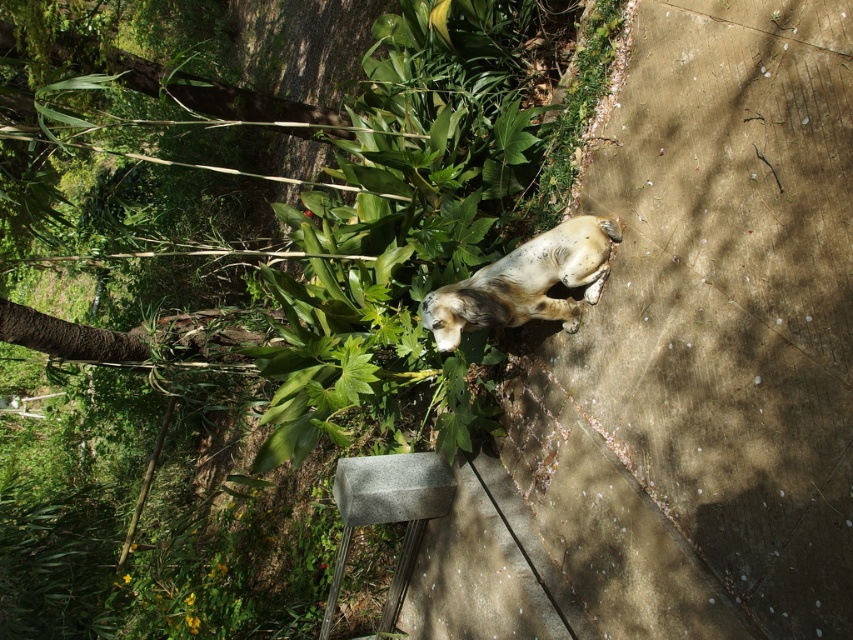
Question: Among these objects, which one is farthest from the camera?

Choices:
 (A) speckled fur dog at center
 (B) gray concrete block at lower center

Answer: (B)

Question: Is speckled fur dog at center positioned at the back of gray concrete block at lower center?

Choices:
 (A) yes
 (B) no

Answer: (B)

Question: Which point appears farthest from the camera in this image?

Choices:
 (A) (488, 300)
 (B) (392, 497)

Answer: (B)

Question: Does speckled fur dog at center have a smaller size compared to gray concrete block at lower center?

Choices:
 (A) no
 (B) yes

Answer: (B)

Question: Considering the relative positions of speckled fur dog at center and gray concrete block at lower center in the image provided, where is speckled fur dog at center located with respect to gray concrete block at lower center?

Choices:
 (A) left
 (B) right

Answer: (B)